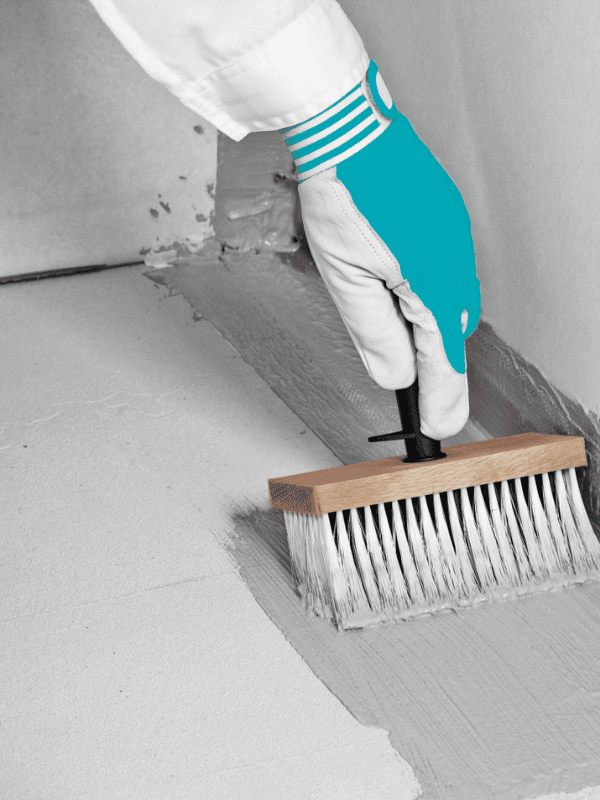
At what (x,y) coordinates should I click in order to perform the action: click on floor. Please return your answer as a coordinate pair (x, y). The width and height of the screenshot is (600, 800). Looking at the image, I should click on (121, 474).